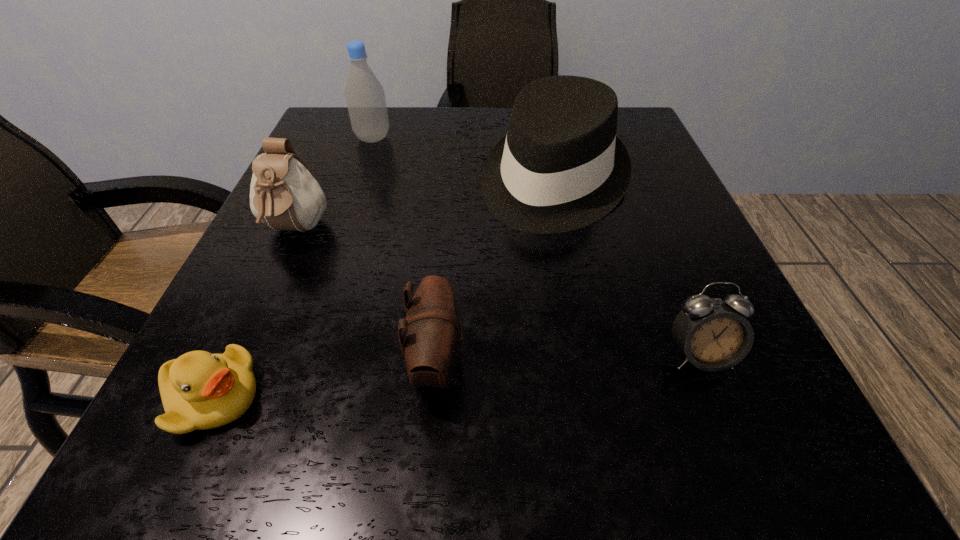
Where is `vacant space located 0.260m on the front-facing side of the farther pouch`? vacant space located 0.260m on the front-facing side of the farther pouch is located at coordinates (215, 410).

The height and width of the screenshot is (540, 960). I want to click on free space located 0.140m with the flap open on the fourth object from left to right, so click(x=572, y=363).

The height and width of the screenshot is (540, 960). What are the coordinates of `free region located 0.100m on the face of the alarm clock` in the screenshot? It's located at (741, 458).

Locate an element on the screen. The width and height of the screenshot is (960, 540). free region located 0.190m on the front-facing side of the shortest object is located at coordinates (415, 397).

The width and height of the screenshot is (960, 540). I want to click on bottle present at the far edge, so click(x=365, y=97).

The width and height of the screenshot is (960, 540). Find the location of `fedora situated at the far edge`. fedora situated at the far edge is located at coordinates [x=561, y=167].

The image size is (960, 540). I want to click on object located at the near edge, so click(199, 390).

The height and width of the screenshot is (540, 960). What are the coordinates of `bottle that is at the left edge` in the screenshot? It's located at (365, 97).

At what (x,y) coordinates should I click in order to perform the action: click on pouch that is at the left edge. Please return your answer as a coordinate pair (x, y). This screenshot has width=960, height=540. Looking at the image, I should click on (284, 195).

You are a GUI agent. You are given a task and a screenshot of the screen. Output one action in this format:
    pyautogui.click(x=<x>, y=<y>)
    Task: Click on the duckling positioned at the left edge
    The height and width of the screenshot is (540, 960).
    Given the screenshot: What is the action you would take?
    pyautogui.click(x=199, y=390)